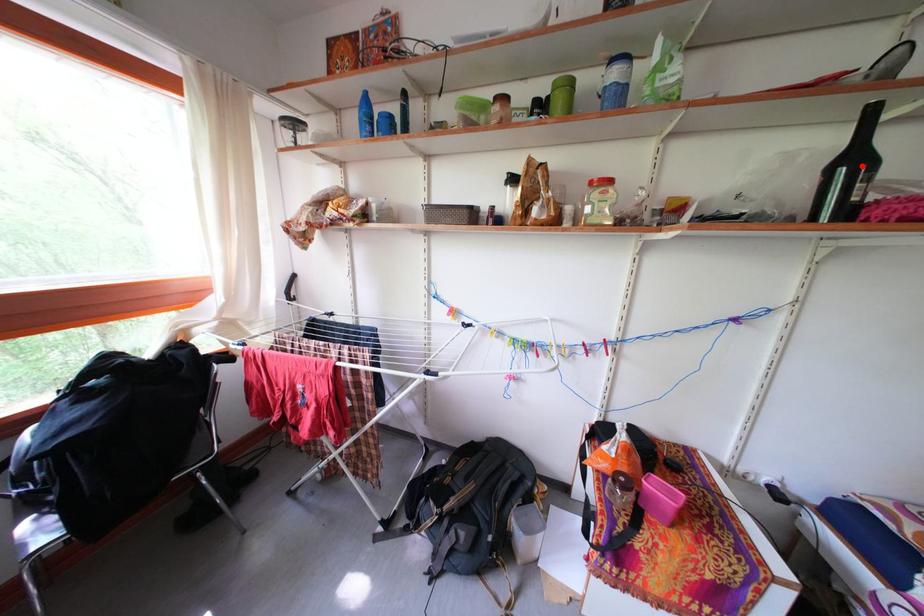
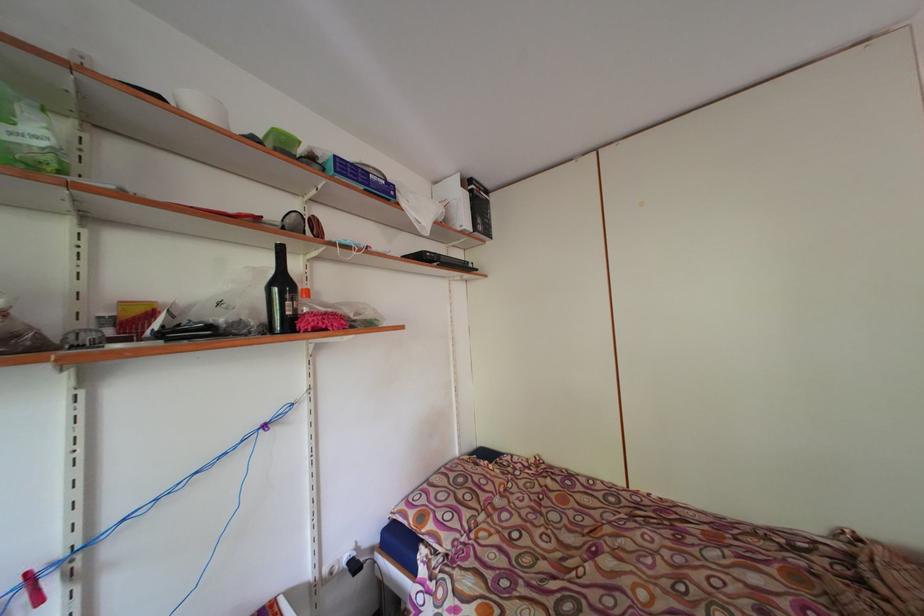
Locate, in the second image, the point that corresponds to the highlighted location in the first image.

(290, 289)